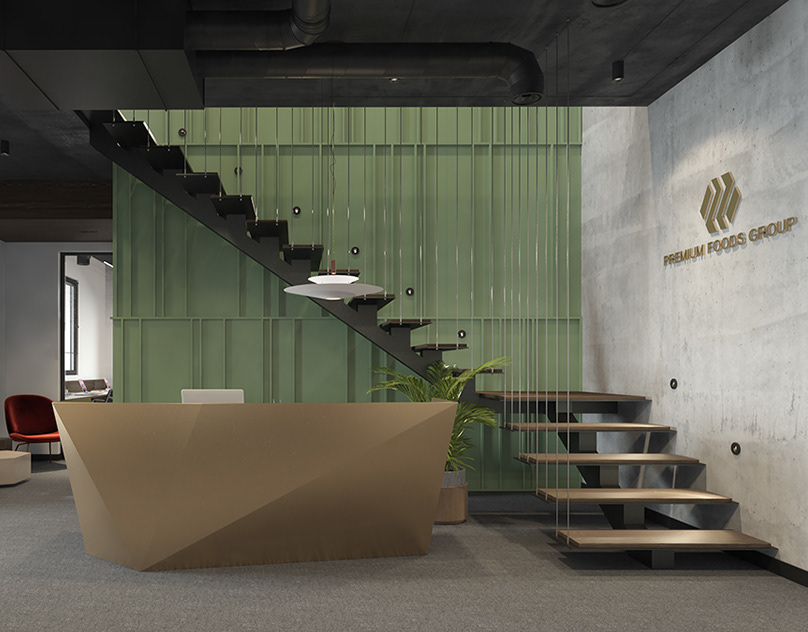
You are a GUI agent. You are given a task and a screenshot of the screen. Output one action in this format:
    pyautogui.click(x=<x>, y=<y>)
    Task: Click on the doorway
    The height and width of the screenshot is (632, 808).
    Given the screenshot: What is the action you would take?
    pyautogui.click(x=65, y=250)